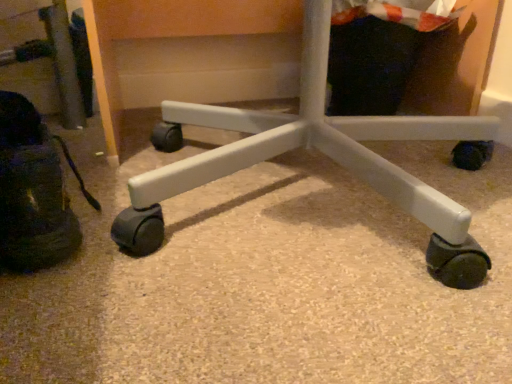
Find the location of `white plastic chair at center`. white plastic chair at center is located at coordinates (320, 151).

Looking at this image, what is the approximate width of white plastic chair at center?

24.97 inches.

This screenshot has width=512, height=384. What do you see at coordinates (320, 151) in the screenshot?
I see `white plastic chair at center` at bounding box center [320, 151].

Locate an element on the screen. The image size is (512, 384). white plastic chair at center is located at coordinates (x=320, y=151).